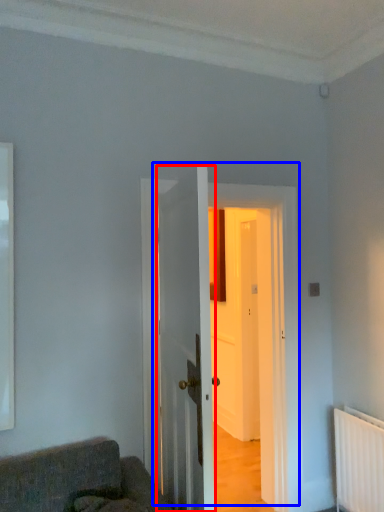
Question: Which object appears farthest to the camera in this image, door (highlighted by a red box) or door (highlighted by a blue box)?

Choices:
 (A) door
 (B) door

Answer: (B)